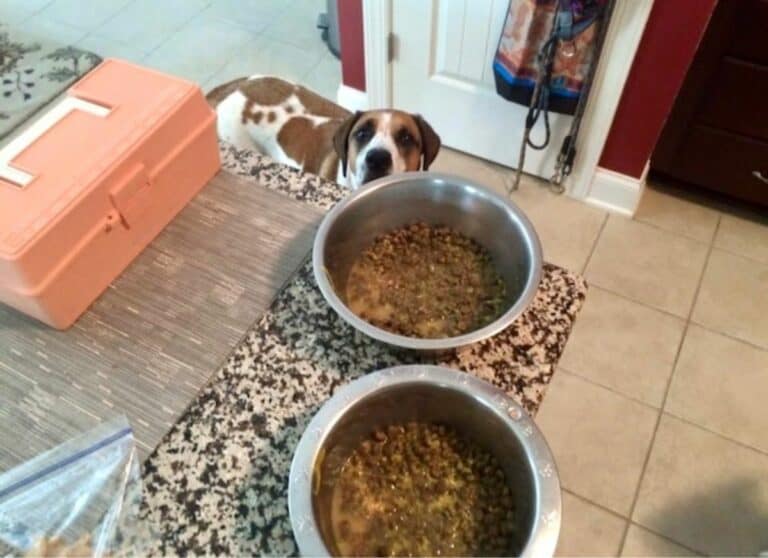
In order to click on silver trashcan in this screenshot , I will do `click(330, 32)`.